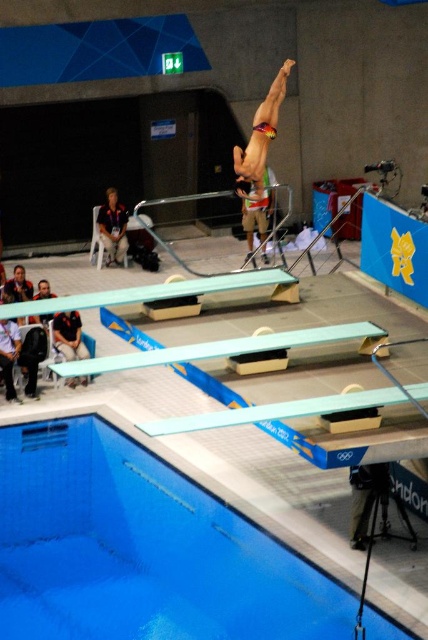
Does matte yellow swimsuit at center appear over light brown leather jacket at lower left?

Yes, matte yellow swimsuit at center is above light brown leather jacket at lower left.

Is point (247, 246) positioned after point (110, 244)?

That is True.

The height and width of the screenshot is (640, 428). I want to click on matte yellow swimsuit at center, so click(256, 214).

Is point (413, 388) less distant than point (264, 173)?

Yes, point (413, 388) is in front of point (264, 173).

Identify the location of smooth white diving board at center. (276, 412).

Locate an element on the screen. The height and width of the screenshot is (640, 428). smooth white diving board at center is located at coordinates (276, 412).

Which is more to the right, smooth white diving board at center or multicolored bikini at center?

multicolored bikini at center is more to the right.

Is smooth white diving board at center above multicolored bikini at center?

Actually, smooth white diving board at center is below multicolored bikini at center.

You are a GUI agent. You are given a task and a screenshot of the screen. Output one action in this format:
    pyautogui.click(x=<x>, y=<y>)
    Task: Click on the smooth white diving board at center
    The image size is (428, 640).
    Given the screenshot: What is the action you would take?
    pyautogui.click(x=276, y=412)